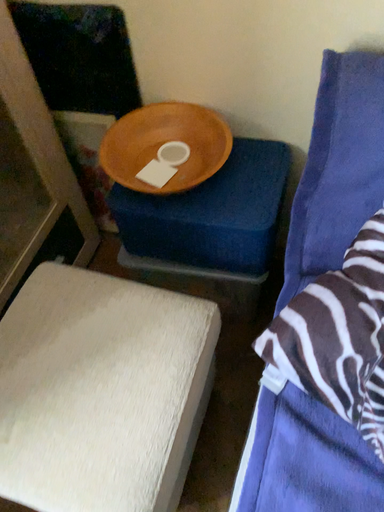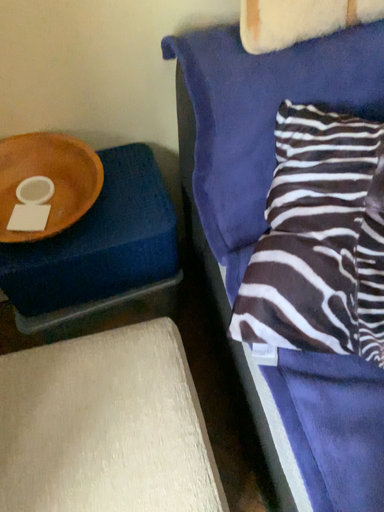
Question: How did the camera likely rotate when shooting the video?

Choices:
 (A) rotated left
 (B) rotated right

Answer: (B)